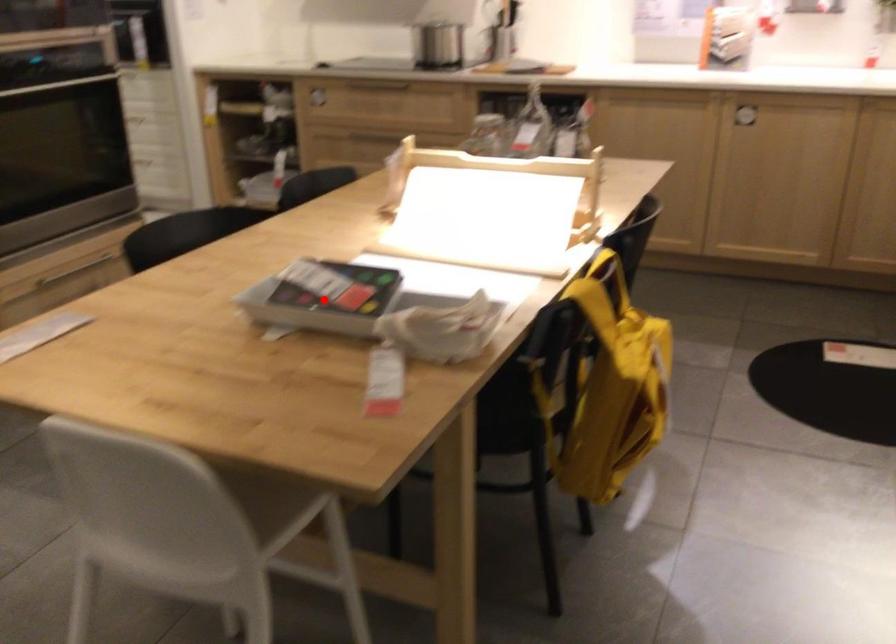
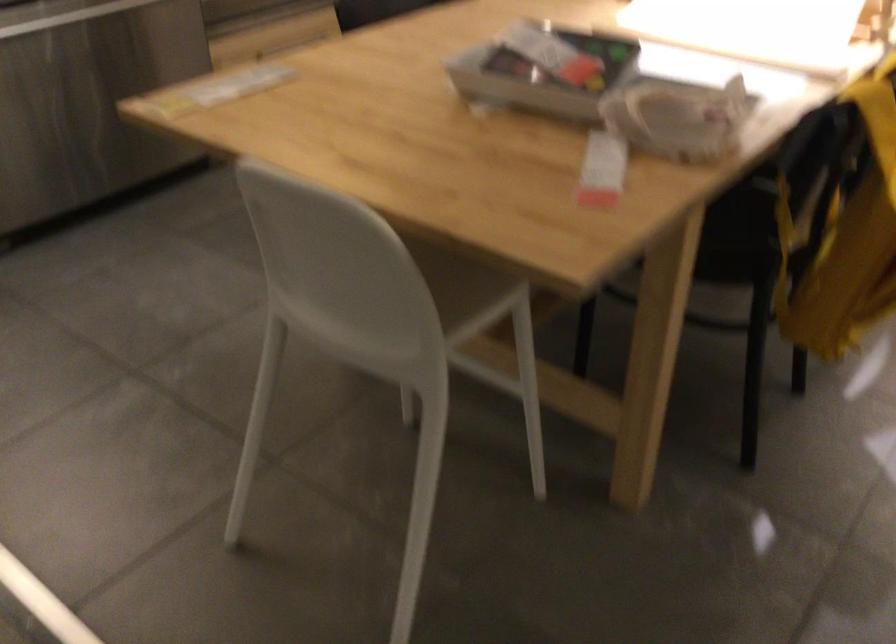
In the second image, find the point that corresponds to the highlighted location in the first image.

(544, 73)